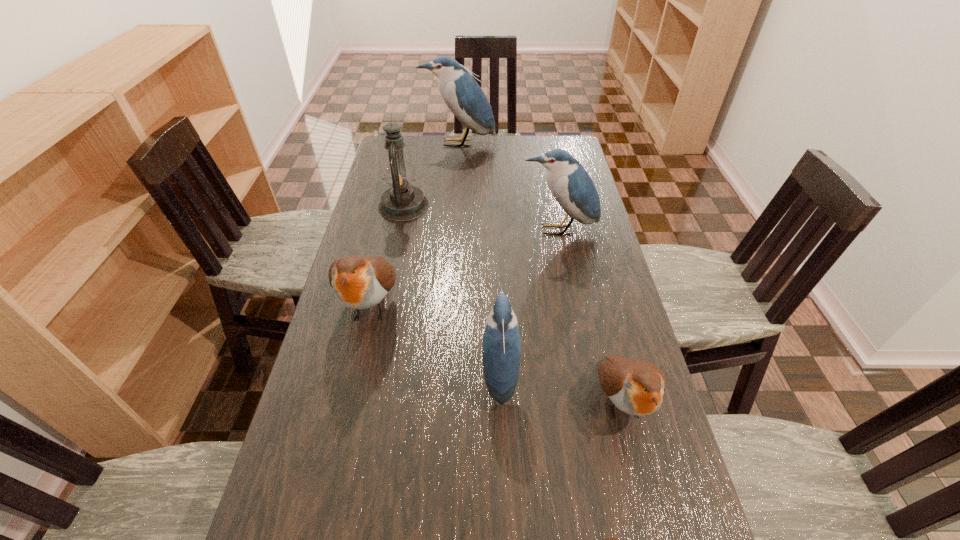
The height and width of the screenshot is (540, 960). I want to click on vacant area situated at the tip of the farthest bird's beak, so click(x=456, y=186).

Locate an element on the screen. free space located 0.290m on the right of the oil lamp is located at coordinates (510, 206).

At what (x,y) coordinates should I click in order to perform the action: click on vacant space positioned at the tip of the second biggest blue bird's beak. Please return your answer as a coordinate pair (x, y). The image size is (960, 540). Looking at the image, I should click on (565, 267).

At what (x,y) coordinates should I click in order to perform the action: click on vacant space located at the face of the farthest brown bird. Please return your answer as a coordinate pair (x, y). Image resolution: width=960 pixels, height=540 pixels. Looking at the image, I should click on (323, 516).

What are the coordinates of `free space located 0.370m at the tip of the nearest blue bird's beak` in the screenshot? It's located at (333, 374).

Identify the location of free space located 0.270m at the tip of the nearest blue bird's beak. The height and width of the screenshot is (540, 960). (373, 374).

I want to click on vacant area situated at the tip of the nearest blue bird's beak, so click(x=421, y=374).

This screenshot has width=960, height=540. I want to click on free point located at the face of the second shortest object, so point(640,479).

What are the coordinates of `object present at the far edge` in the screenshot? It's located at (462, 94).

Locate an element on the screen. Image resolution: width=960 pixels, height=540 pixels. oil lamp that is at the left edge is located at coordinates (402, 202).